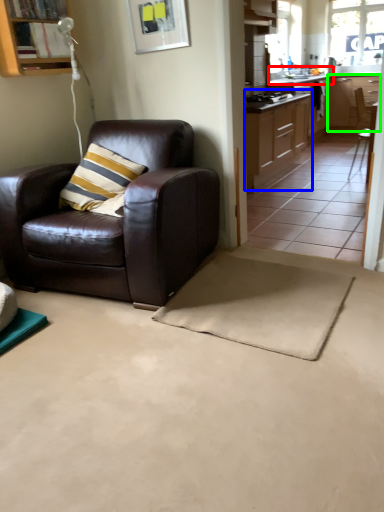
Question: Considering the real-world distances, which object is farthest from sink (highlighted by a red box)? cabinetry (highlighted by a blue box) or cabinetry (highlighted by a green box)?

Choices:
 (A) cabinetry
 (B) cabinetry

Answer: (A)